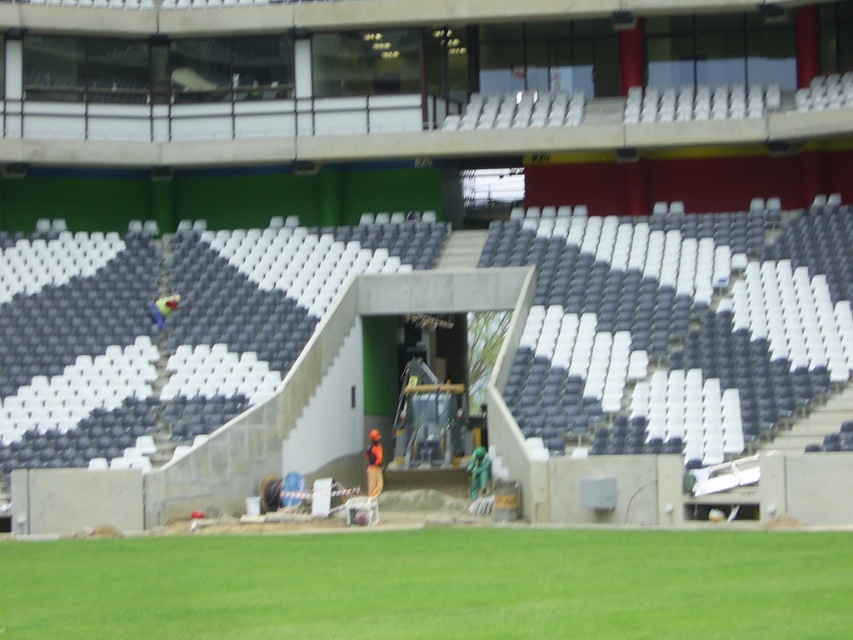
You are a construction worker needing to reach the maintenance area below the concrete stairs at center. Can you step directly onto the green grass at lower center from the stairs?

The concrete stairs at center is positioned over green grass at lower center, so yes, you can step directly onto the green grass at lower center from the stairs.

You are a construction worker standing at the point labeled as point (48, 561) and need to reach the point labeled as point (695, 342). Given the stadium layout described, which direction should you move to reach your destination?

To reach point (695, 342) from point (48, 561), you should move upward because point (695, 342) is behind point (48, 561), indicating it is located in a higher section of the stadium.